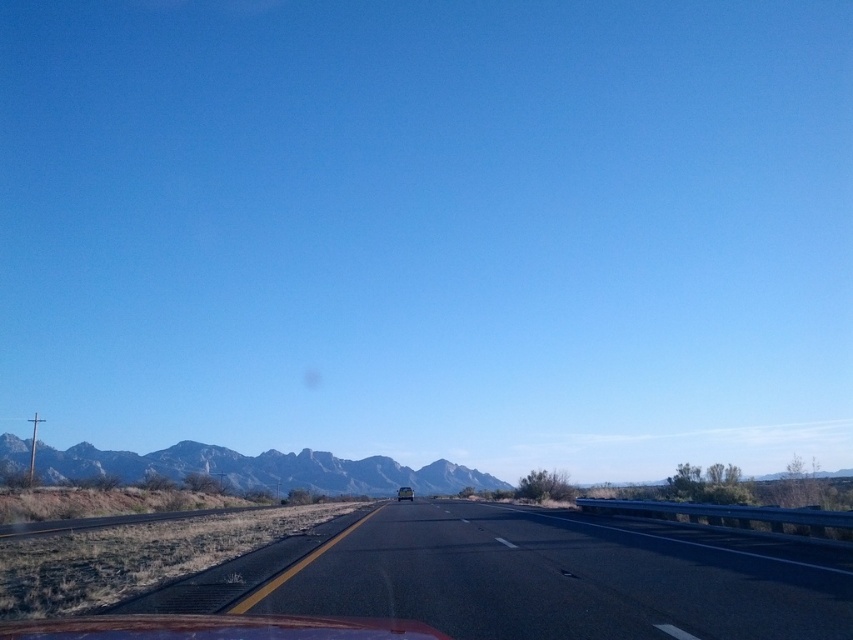
Does black asphalt highway at center have a greater width compared to shiny silver sedan at center?

Indeed, black asphalt highway at center has a greater width compared to shiny silver sedan at center.

Can you confirm if black asphalt highway at center is bigger than shiny silver sedan at center?

Incorrect, black asphalt highway at center is not larger than shiny silver sedan at center.

Which is behind, point (753, 548) or point (412, 493)?

The point (412, 493) is behind.

This screenshot has width=853, height=640. Identify the location of black asphalt highway at center. (531, 577).

Is rugged brown mountains at center to the right of shiny silver sedan at center from the viewer's perspective?

In fact, rugged brown mountains at center is to the left of shiny silver sedan at center.

Is rugged brown mountains at center thinner than shiny silver sedan at center?

No, rugged brown mountains at center is not thinner than shiny silver sedan at center.

Is point (82, 465) farther from viewer compared to point (410, 497)?

Yes.

Where is `rugged brown mountains at center`? This screenshot has height=640, width=853. rugged brown mountains at center is located at coordinates (262, 468).

From the picture: Between black asphalt highway at center and rugged brown mountains at center, which one has less height?

black asphalt highway at center is shorter.

Who is taller, black asphalt highway at center or rugged brown mountains at center?

With more height is rugged brown mountains at center.

Which is in front, point (741, 612) or point (65, 480)?

Point (741, 612)

Identify the location of black asphalt highway at center. (531, 577).